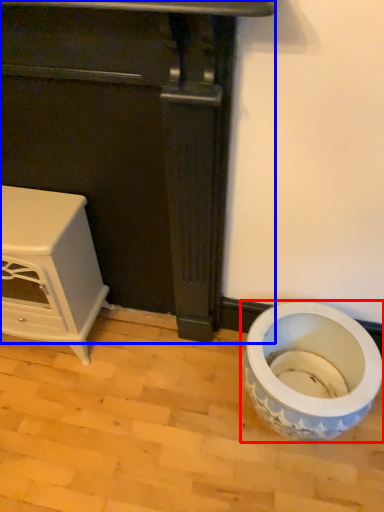
Question: Which object is closer to the camera taking this photo, toilet (highlighted by a red box) or furniture (highlighted by a blue box)?

Choices:
 (A) toilet
 (B) furniture

Answer: (B)